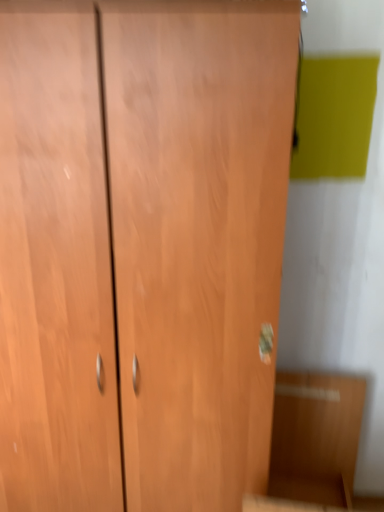
This screenshot has width=384, height=512. I want to click on wooden cabinet at lower right, so click(315, 437).

This screenshot has height=512, width=384. Describe the element at coordinates (315, 437) in the screenshot. I see `wooden cabinet at lower right` at that location.

At what (x,y) coordinates should I click in order to perform the action: click on wooden cabinet at lower right. Please return your answer as a coordinate pair (x, y). Looking at the image, I should click on (315, 437).